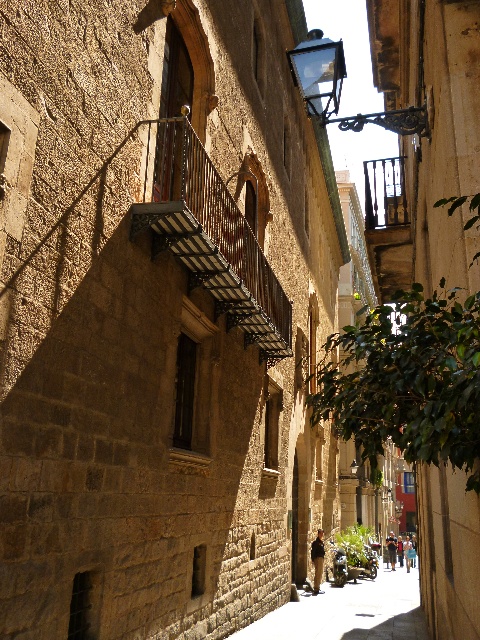
Based on the photo, you are a delivery drone that is 1.5 meters wide. You need to fly through the narrow alleyway shown in the image. The alleyway has a smooth stone alley at center and a clear glass lantern at upper center. Can you safely pass through the alleyway without touching either object?

The smooth stone alley at center and clear glass lantern at upper center are 14.80 meters apart from each other. Since the drone is only 1.5 meters wide, there is sufficient space between the two objects to allow safe passage without touching either.

You are a delivery person carrying a package that requires a safe path between the clear glass lantern at upper center and the wooden at upper center. The package must be kept at least 2 meters away from both objects to avoid damage. Can you safely pass between them?

The clear glass lantern at upper center is 3.11 meters away from wooden at upper center. Since the required minimum distance between the package and both objects is 2 meters, the total required space would be 2 meters on each side, totaling 4 meters. However, the distance between them is only 3.11 meters, which is less than 4 meters. Therefore, you cannot safely pass between them without coming closer than 2 meters to at least one of the objects.

You are a delivery person carrying a large package and need to navigate through the narrow alleyway. You notice a clear glass lantern at upper center and a wooden at upper center. Which object might pose a lower risk of collision if you need to pass under them?

The wooden at upper center is smaller in size compared to the clear glass lantern at upper center, so it might pose a lower risk of collision when passing under them.